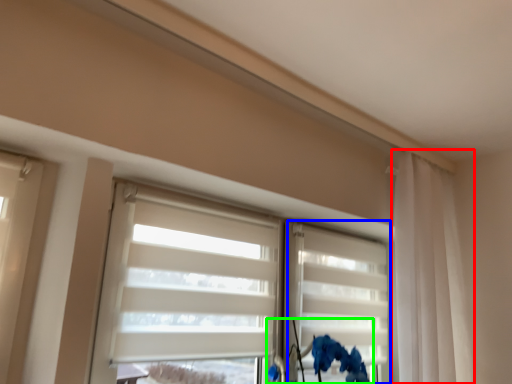
Question: Which object is the farthest from curtain (highlighted by a red box)? Choose among these: shutter (highlighted by a blue box) or floral arrangement (highlighted by a green box).

Choices:
 (A) shutter
 (B) floral arrangement

Answer: (B)